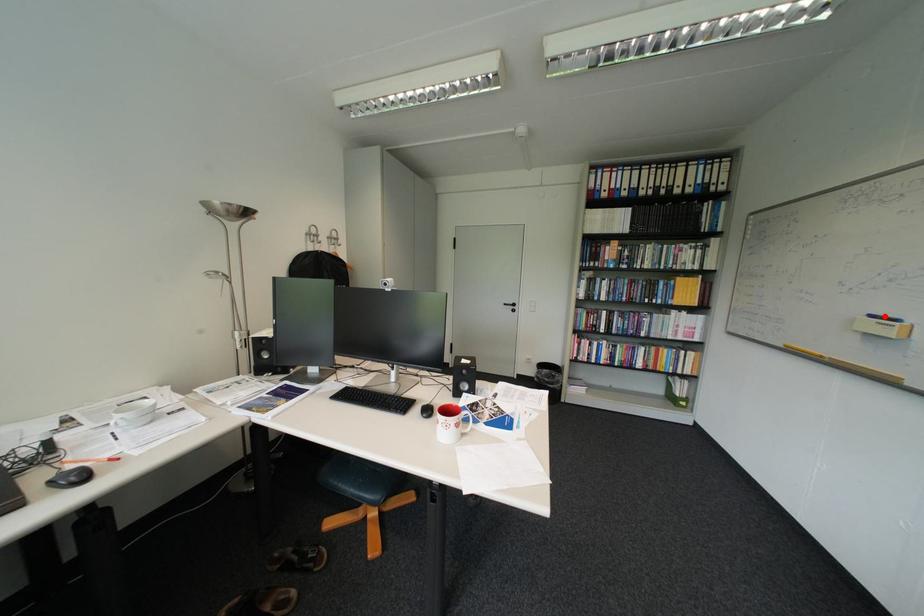
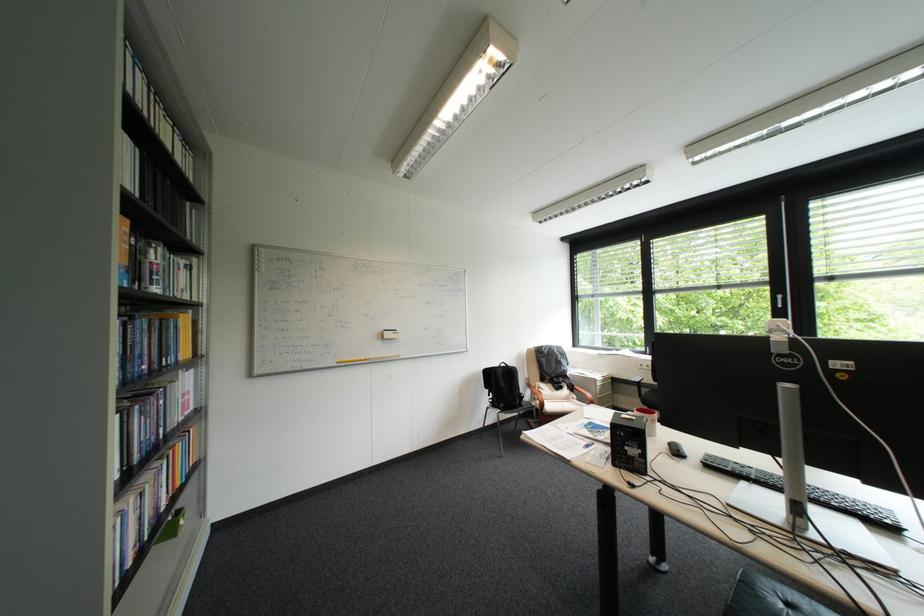
Where in the second image is the point corresponding to the highlighted location from the first image?

(397, 331)